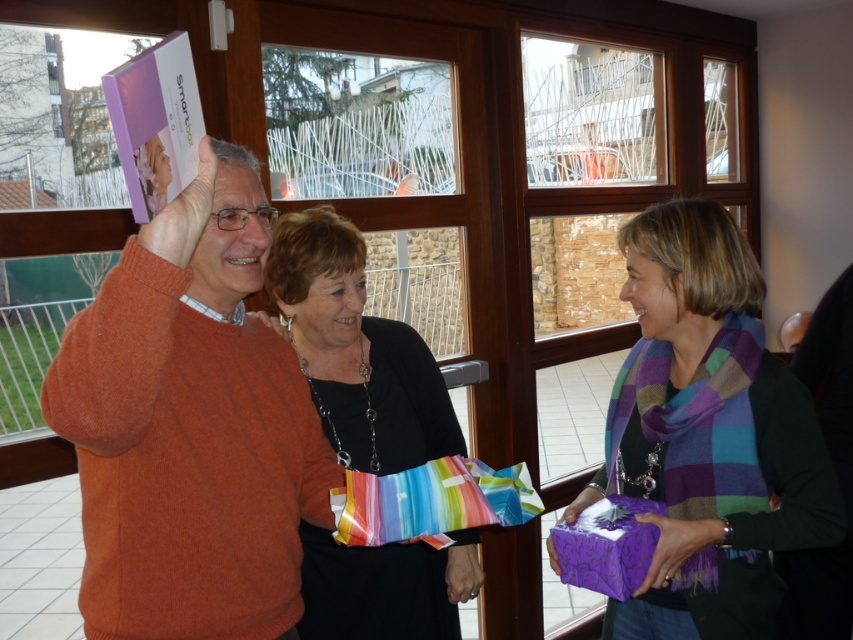
From the picture: You are standing in the room shown in the image and want to place a new decorative item on the floor near the black fabric purse at center. Which coordinate should you use to place it closest to the purse?

You should place the decorative item near the coordinate point closest to the black fabric purse at center at point [357,349].

You are standing in the room and want to reach a point in the scene. The point is located at coordinates point (755, 477). If you are 1.8 meters tall, can you comfortably reach that point without stretching?

The distance of point (755, 477) from viewer is 1.33 meters. Since the point is only 1.33 meters away, and assuming average arm length, you can comfortably reach it without stretching.